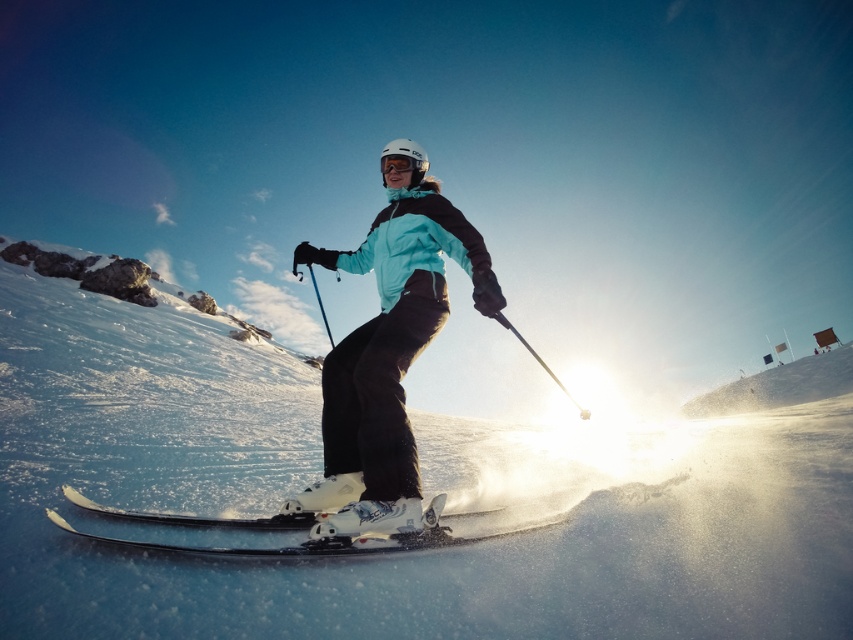
In the scene shown: You are a photographer trying to capture the skier in the image. You want to ensure both the matte blue jacket at center and the transparent plastic goggles at center are clearly visible in your shot. Given their sizes, which object might be harder to see clearly in the photo?

The transparent plastic goggles at center might be harder to see clearly because the matte blue jacket at center is larger in size than the transparent plastic goggles at center, making the smaller goggles potentially less distinct against the bright snowy background.

You are a photographer trying to capture a closeup of the transparent plastic goggles at center while ensuring the white powder snow at center is also visible. Since both are at the center, will the snow cover the goggles in the photo?

The white powder snow at center has a larger width than the transparent plastic goggles at center, so the snow will cover the goggles in the photo.

You are a photographer trying to capture the skier in the image. You want to ensure that both the white powder snow at center and the transparent plastic goggles at center are clearly visible in your photo. Given their sizes, which object might be harder to focus on and why?

The transparent plastic goggles at center might be harder to focus on because they are smaller than the white powder snow at center, making them more challenging to capture clearly in the photo.